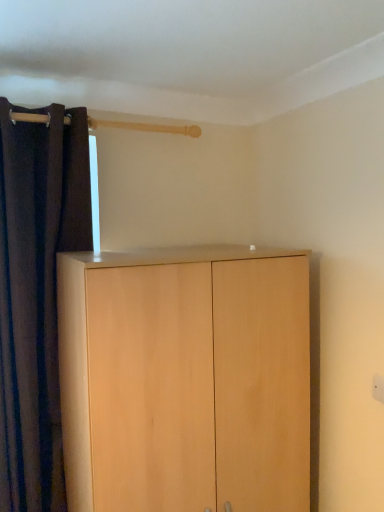
Question: From the image's perspective, does light wood cupboard at center appear lower than dark fabric curtain at left?

Choices:
 (A) no
 (B) yes

Answer: (B)

Question: Is light wood cupboard at center oriented away from dark fabric curtain at left?

Choices:
 (A) no
 (B) yes

Answer: (A)

Question: Considering the relative positions of light wood cupboard at center and dark fabric curtain at left in the image provided, is light wood cupboard at center to the left of dark fabric curtain at left from the viewer's perspective?

Choices:
 (A) no
 (B) yes

Answer: (A)

Question: Are light wood cupboard at center and dark fabric curtain at left far apart?

Choices:
 (A) no
 (B) yes

Answer: (A)

Question: Considering the relative sizes of light wood cupboard at center and dark fabric curtain at left in the image provided, is light wood cupboard at center wider than dark fabric curtain at left?

Choices:
 (A) no
 (B) yes

Answer: (B)

Question: From a real-world perspective, does light wood cupboard at center sit lower than dark fabric curtain at left?

Choices:
 (A) no
 (B) yes

Answer: (B)

Question: Is dark fabric curtain at left not near light wood cupboard at center?

Choices:
 (A) no
 (B) yes

Answer: (A)

Question: Does dark fabric curtain at left have a lesser width compared to light wood cupboard at center?

Choices:
 (A) yes
 (B) no

Answer: (A)

Question: Would you say dark fabric curtain at left contains light wood cupboard at center?

Choices:
 (A) yes
 (B) no

Answer: (B)

Question: From the image's perspective, is dark fabric curtain at left on light wood cupboard at center?

Choices:
 (A) yes
 (B) no

Answer: (A)

Question: Could you tell me if dark fabric curtain at left is turned towards light wood cupboard at center?

Choices:
 (A) yes
 (B) no

Answer: (B)

Question: Is dark fabric curtain at left in front of light wood cupboard at center?

Choices:
 (A) no
 (B) yes

Answer: (A)

Question: Is dark fabric curtain at left wider or thinner than light wood cupboard at center?

Choices:
 (A) wide
 (B) thin

Answer: (B)